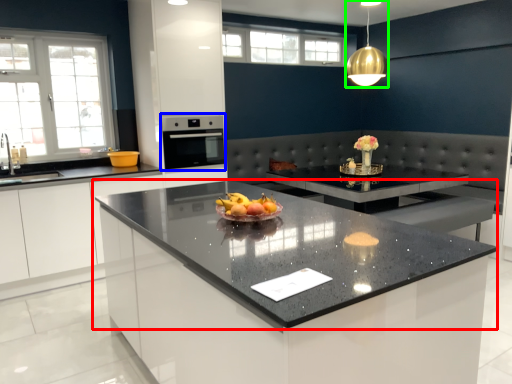
Question: Considering the real-world distances, which object is farthest from countertop (highlighted by a red box)? oven (highlighted by a blue box) or light fixture (highlighted by a green box)?

Choices:
 (A) oven
 (B) light fixture

Answer: (B)